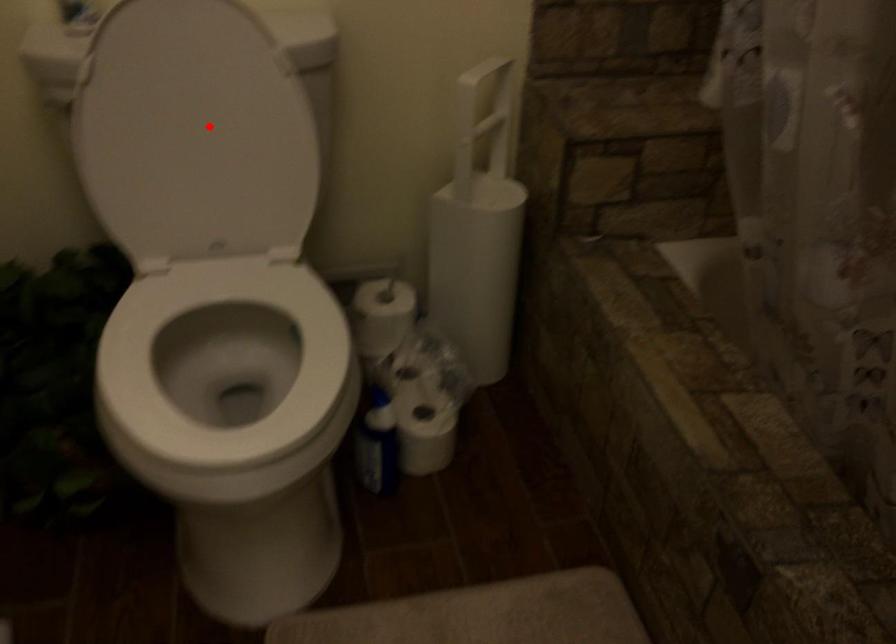
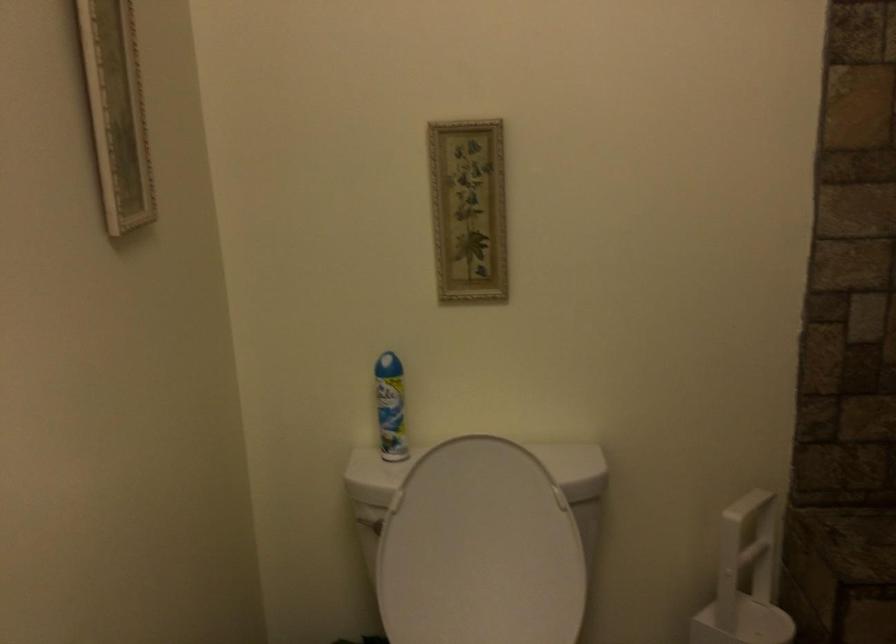
Question: I am providing you with two images of the same scene from different viewpoints. Image1 has a red point marked. In image2, the corresponding 3D location appears at what relative position? Reply with the corresponding letter.

Choices:
 (A) Closer
 (B) Farther

Answer: (B)